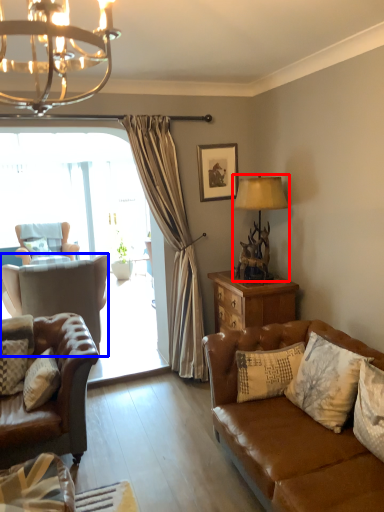
Question: Which point is further to the camera, lamp (highlighted by a red box) or chair (highlighted by a blue box)?

Choices:
 (A) lamp
 (B) chair

Answer: (B)